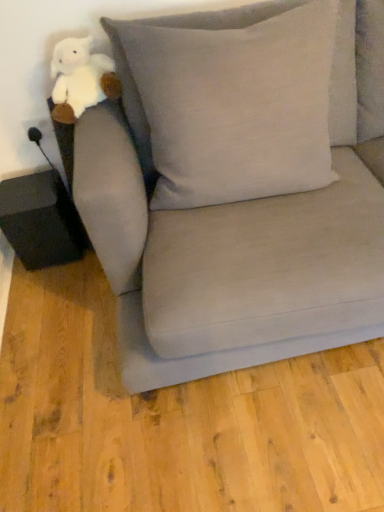
Question: Considering the relative sizes of matte gray couch at center and light gray linen pillow at upper center in the image provided, is matte gray couch at center taller than light gray linen pillow at upper center?

Choices:
 (A) yes
 (B) no

Answer: (A)

Question: Is the depth of matte gray couch at center less than that of light gray linen pillow at upper center?

Choices:
 (A) no
 (B) yes

Answer: (B)

Question: From the image's perspective, is matte gray couch at center under light gray linen pillow at upper center?

Choices:
 (A) yes
 (B) no

Answer: (A)

Question: Can you confirm if matte gray couch at center is wider than light gray linen pillow at upper center?

Choices:
 (A) no
 (B) yes

Answer: (B)

Question: Considering the relative positions of matte gray couch at center and light gray linen pillow at upper center in the image provided, is matte gray couch at center behind light gray linen pillow at upper center?

Choices:
 (A) yes
 (B) no

Answer: (B)

Question: From a real-world perspective, is light gray linen pillow at upper center positioned above or below matte gray couch at center?

Choices:
 (A) above
 (B) below

Answer: (A)

Question: Choose the correct answer: Is light gray linen pillow at upper center inside matte gray couch at center or outside it?

Choices:
 (A) outside
 (B) inside

Answer: (B)

Question: Is light gray linen pillow at upper center taller or shorter than matte gray couch at center?

Choices:
 (A) tall
 (B) short

Answer: (B)

Question: Is light gray linen pillow at upper center to the left or to the right of matte gray couch at center in the image?

Choices:
 (A) left
 (B) right

Answer: (A)

Question: Would you say white plush toy at upper left is to the left or to the right of light gray linen pillow at upper center in the picture?

Choices:
 (A) left
 (B) right

Answer: (A)

Question: Is white plush toy at upper left in front of or behind light gray linen pillow at upper center in the image?

Choices:
 (A) behind
 (B) front

Answer: (A)

Question: Considering the positions of white plush toy at upper left and light gray linen pillow at upper center in the image, is white plush toy at upper left taller or shorter than light gray linen pillow at upper center?

Choices:
 (A) short
 (B) tall

Answer: (A)

Question: From a real-world perspective, is white plush toy at upper left above or below light gray linen pillow at upper center?

Choices:
 (A) below
 (B) above

Answer: (B)

Question: From the image's perspective, is matte gray couch at center located above or below light gray linen pillow at upper center?

Choices:
 (A) above
 (B) below

Answer: (B)

Question: Does point (162, 223) appear closer or farther from the camera than point (210, 34)?

Choices:
 (A) farther
 (B) closer

Answer: (A)